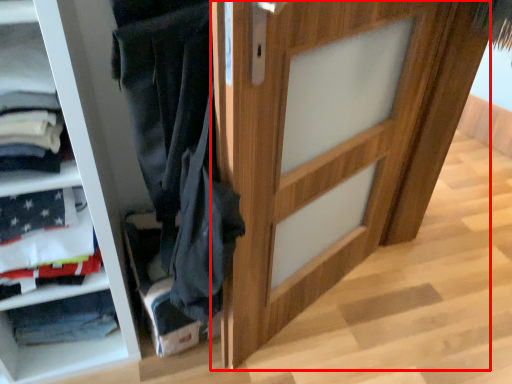
Question: From the image's perspective, what is the correct spatial relationship of door (annotated by the red box) in relation to shelf?

Choices:
 (A) below
 (B) above

Answer: (B)